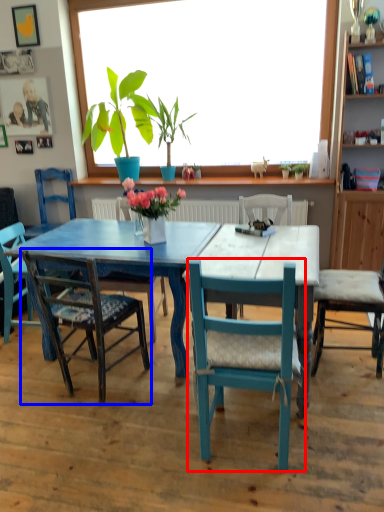
Question: Which object is closer to the camera taking this photo, chair (highlighted by a red box) or chair (highlighted by a blue box)?

Choices:
 (A) chair
 (B) chair

Answer: (A)